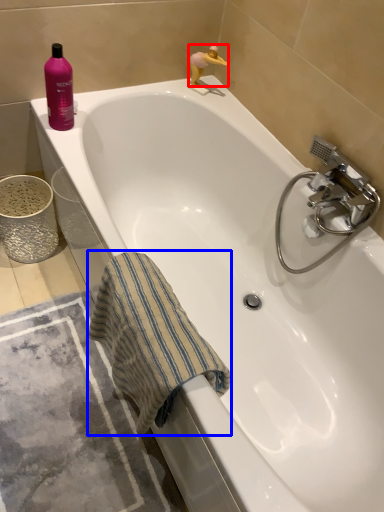
Question: Which point is further to the camera, toy (highlighted by a red box) or beach towel (highlighted by a blue box)?

Choices:
 (A) toy
 (B) beach towel

Answer: (A)